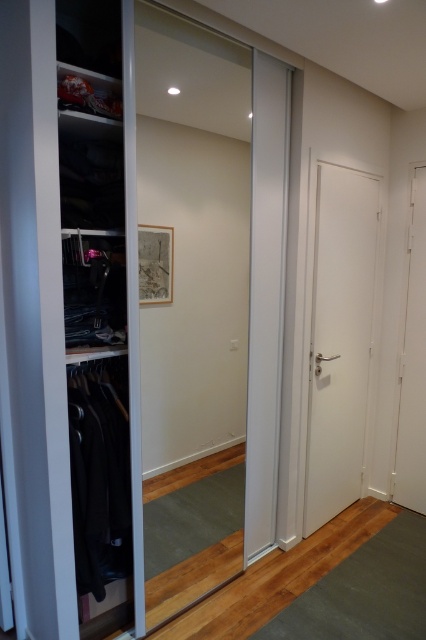
Is white smooth door at right positioned in front of white matte door at right?

Yes, white smooth door at right is closer to the viewer.

Does white smooth door at right appear on the left side of white matte door at right?

Yes, white smooth door at right is to the left of white matte door at right.

The height and width of the screenshot is (640, 426). What do you see at coordinates (339, 339) in the screenshot?
I see `white smooth door at right` at bounding box center [339, 339].

Where is `white smooth door at right`? white smooth door at right is located at coordinates (339, 339).

Which is above, transparent glass door at center or white matte door at right?

Positioned higher is transparent glass door at center.

Who is more distant from viewer, [176,19] or [414,262]?

The point [414,262] is behind.

I want to click on transparent glass door at center, so click(x=192, y=300).

Between transparent glass door at center and white smooth door at right, which one appears on the right side from the viewer's perspective?

white smooth door at right is more to the right.

The width and height of the screenshot is (426, 640). I want to click on transparent glass door at center, so click(x=192, y=300).

Who is more distant from viewer, (222, 76) or (340, 472)?

The point (340, 472) is more distant.

Where is `transparent glass door at center`? This screenshot has height=640, width=426. transparent glass door at center is located at coordinates (192, 300).